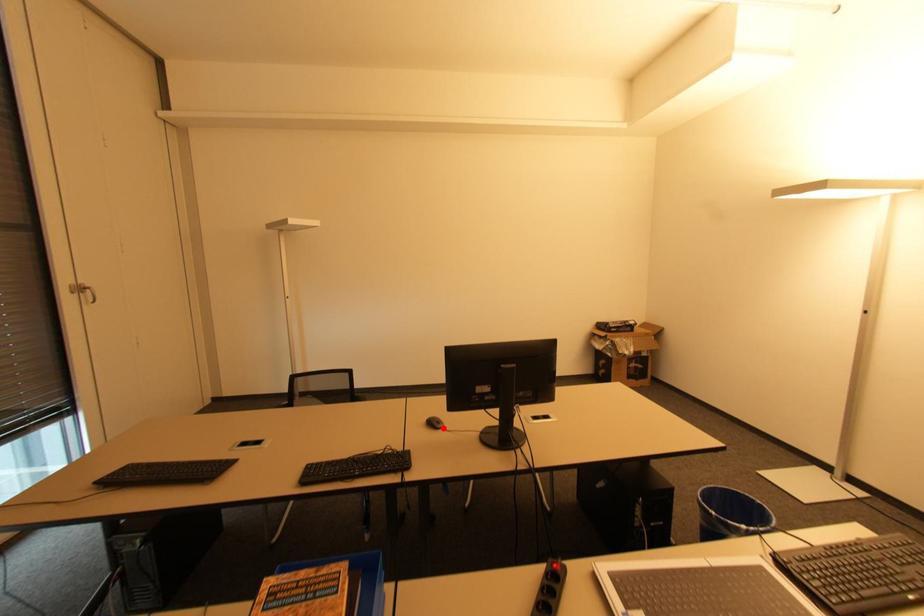
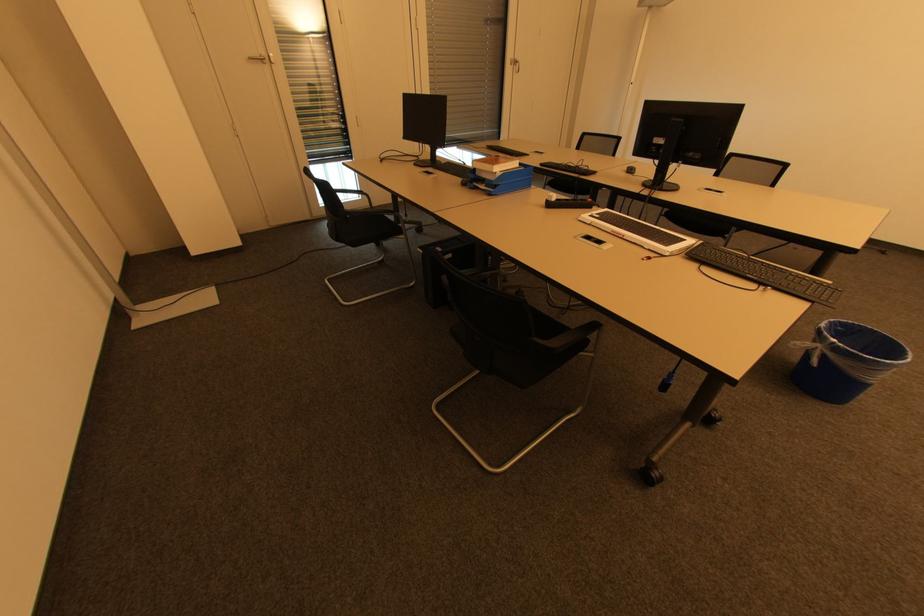
Question: I am providing you with two images of the same scene from different viewpoints. A red point is shown in image1. For the corresponding object point in image2, is it positioned nearer or farther from the camera?

Choices:
 (A) Nearer
 (B) Farther

Answer: (A)